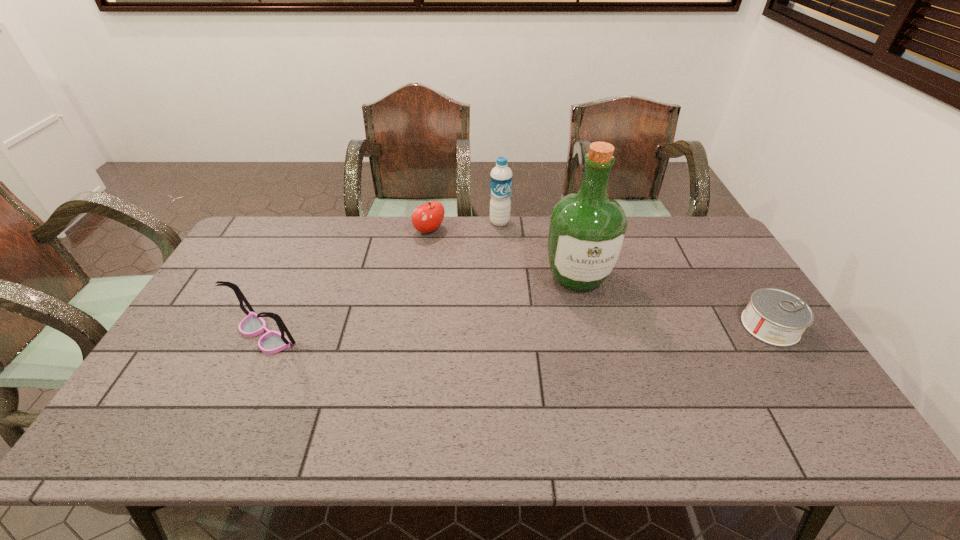
At what (x,y) coordinates should I click in order to perform the action: click on free space located 0.050m on the front-facing side of the tallest object. Please return your answer as a coordinate pair (x, y). The image size is (960, 540). Looking at the image, I should click on (588, 313).

Where is `water bottle at the far edge`? The image size is (960, 540). water bottle at the far edge is located at coordinates (501, 175).

You are a GUI agent. You are given a task and a screenshot of the screen. Output one action in this format:
    pyautogui.click(x=<x>, y=<y>)
    Task: Click on the apple that is at the far edge
    The image size is (960, 540).
    Given the screenshot: What is the action you would take?
    pyautogui.click(x=426, y=218)

Find the location of a particular element. Image resolution: width=960 pixels, height=540 pixels. liquor present at the far edge is located at coordinates (587, 230).

Locate an element on the screen. object positioned at the left edge is located at coordinates tap(253, 324).

Identify the location of object located at the right edge. tap(776, 317).

In the image, there is a desktop. Find the location of `free region at the far edge`. free region at the far edge is located at coordinates (658, 242).

Locate an element on the screen. The image size is (960, 540). blank space at the near edge of the desktop is located at coordinates (354, 390).

This screenshot has height=540, width=960. In order to click on vacant space at the right edge in this screenshot , I will do `click(753, 340)`.

Identify the location of free location at the far left corner of the desktop. The height and width of the screenshot is (540, 960). (283, 237).